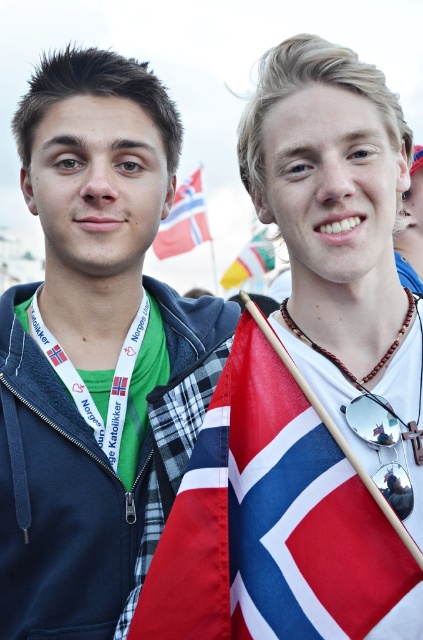
Based on the scene description and the objects provided, what is the significance of the point marked at coordinates (x=384, y=445)?

The point at coordinates (x=384, y=445) marks the location of the silver reflective sunglasses at center.

You are a photographer trying to capture a clear shot of both the silver reflective sunglasses at center and the red fabric flag at upper center. However, the sunglasses are reflecting too much light. Which object should you adjust your camera angle to focus on first to avoid reflections, and why?

You should focus on the red fabric flag at upper center first because the silver reflective sunglasses at center is positioned on the right side of it, meaning adjusting the angle towards the flag might reduce the glare from the sunglasses.